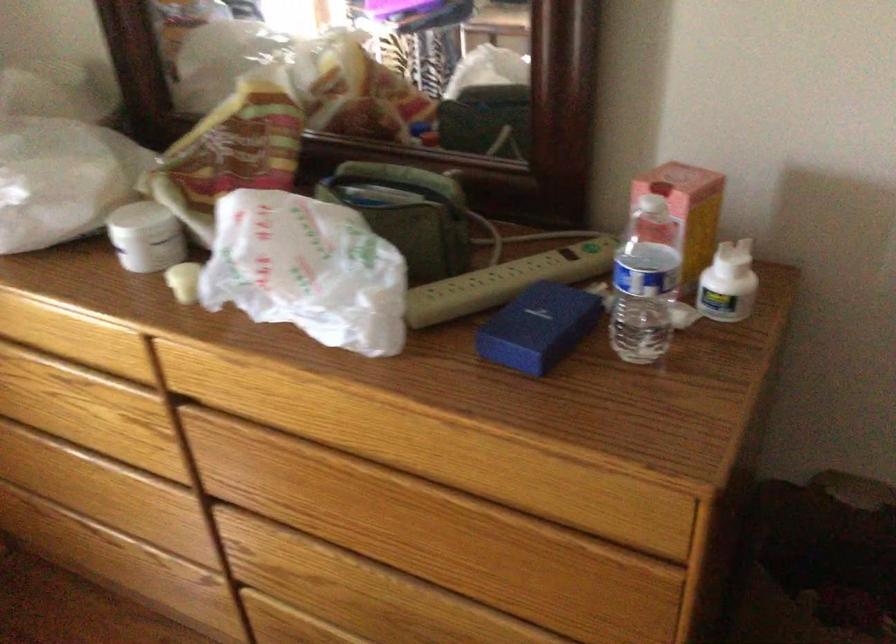
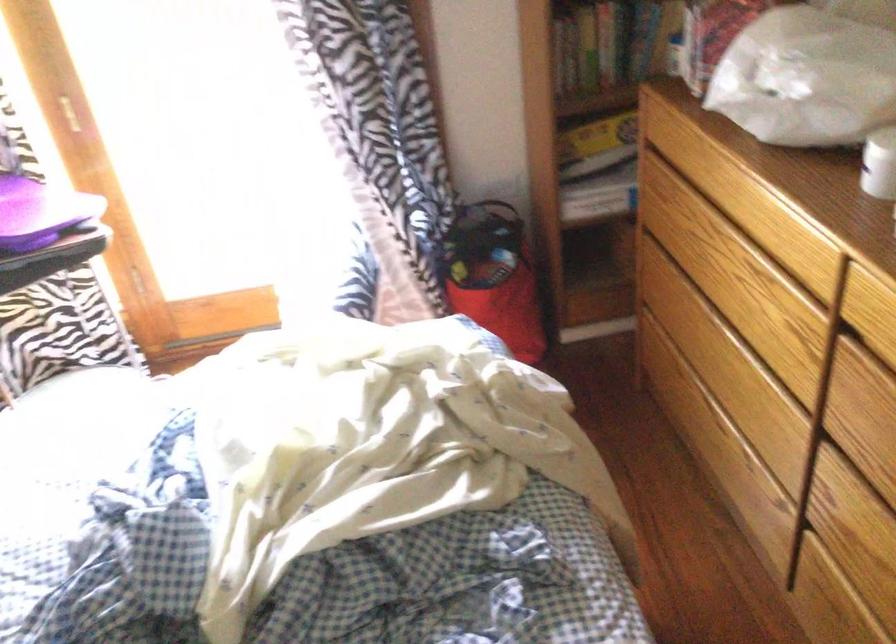
In the second image, find the point that corresponds to (130,245) in the first image.

(879, 164)